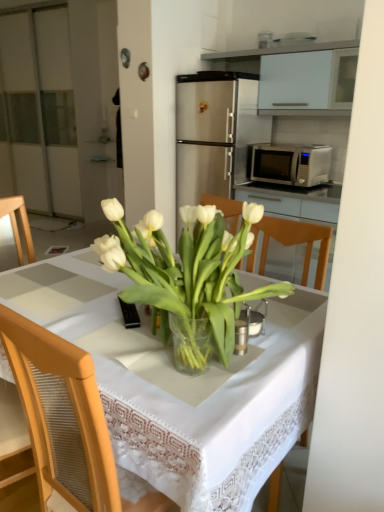
Find the location of a particular element. This screenshot has height=512, width=384. free space in front of black plastic remote control at center is located at coordinates (115, 335).